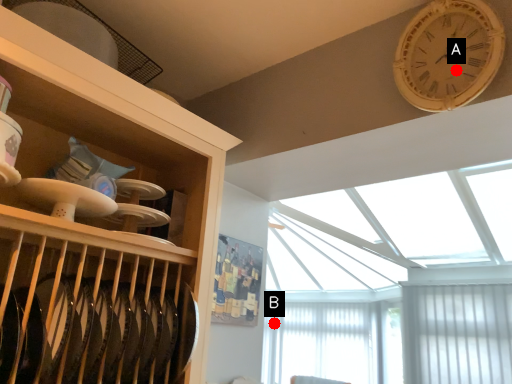
Question: Two points are circled on the image, labeled by A and B beside each circle. Which point is further to the camera?

Choices:
 (A) A is further
 (B) B is further

Answer: (B)